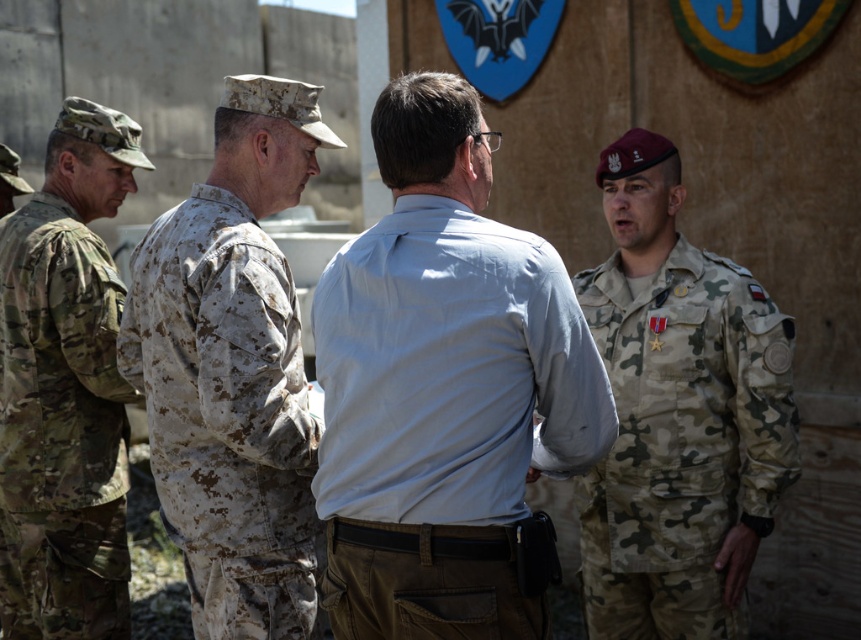
You are standing in front of the group of individuals in the scene. You notice two points marked in the image at coordinates point [214,253] and point [91,452]. Which of these points is nearer to your viewpoint?

Point [214,253] is closer to the camera than point [91,452], so the point at [214,253] is nearer to your viewpoint.